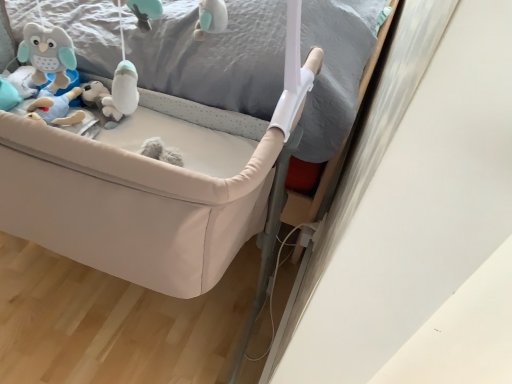
This screenshot has height=384, width=512. Identify the location of beige fabric bed frame at center. point(214,55).

What do you see at coordinates (214, 55) in the screenshot? I see `beige fabric bed frame at center` at bounding box center [214, 55].

What is the approximate width of beige fabric infant bed at center?

36.99 inches.

This screenshot has width=512, height=384. What do you see at coordinates (146, 189) in the screenshot?
I see `beige fabric infant bed at center` at bounding box center [146, 189].

Measure the distance between point (141, 175) and camera.

The depth of point (141, 175) is 25.63 inches.

What are the coordinates of `beige fabric infant bed at center` in the screenshot? It's located at (146, 189).

Find the location of `beige fabric bed frame at center`. beige fabric bed frame at center is located at coordinates [214, 55].

Which is more to the left, beige fabric bed frame at center or beige fabric infant bed at center?

Positioned to the left is beige fabric infant bed at center.

Is beige fabric bed frame at center behind beige fabric infant bed at center?

That is False.

Does point (147, 79) lie in front of point (29, 180)?

No, it is behind (29, 180).

From the image's perspective, would you say beige fabric bed frame at center is positioned over beige fabric infant bed at center?

Yes.

From a real-world perspective, which object stands above the other?

beige fabric bed frame at center, from a real-world perspective.

Considering the relative sizes of beige fabric bed frame at center and beige fabric infant bed at center in the image provided, is beige fabric bed frame at center wider than beige fabric infant bed at center?

In fact, beige fabric bed frame at center might be narrower than beige fabric infant bed at center.

Considering the relative sizes of beige fabric bed frame at center and beige fabric infant bed at center in the image provided, is beige fabric bed frame at center taller than beige fabric infant bed at center?

Incorrect, the height of beige fabric bed frame at center is not larger of that of beige fabric infant bed at center.

Considering the relative sizes of beige fabric bed frame at center and beige fabric infant bed at center in the image provided, is beige fabric bed frame at center smaller than beige fabric infant bed at center?

Correct, beige fabric bed frame at center occupies less space than beige fabric infant bed at center.

Which is correct: beige fabric bed frame at center is inside beige fabric infant bed at center, or outside of it?

beige fabric bed frame at center is not inside beige fabric infant bed at center, it's outside.

Is beige fabric bed frame at center positioned far away from beige fabric infant bed at center?

beige fabric bed frame at center is near beige fabric infant bed at center, not far away.

Is beige fabric bed frame at center oriented away from beige fabric infant bed at center?

That's not correct — beige fabric bed frame at center is not looking away from beige fabric infant bed at center.

How different are the orientations of beige fabric bed frame at center and beige fabric infant bed at center in degrees?

A: beige fabric bed frame at center and beige fabric infant bed at center are facing 2.07 degrees away from each other.

The width and height of the screenshot is (512, 384). Identify the location of infant bed below the beige fabric bed frame at center (from the image's perspective). (146, 189).

Which is more to the left, beige fabric infant bed at center or beige fabric bed frame at center?

beige fabric infant bed at center.

Which object is closer to the camera taking this photo, beige fabric infant bed at center or beige fabric bed frame at center?

Positioned in front is beige fabric bed frame at center.

Is point (300, 110) closer to viewer compared to point (146, 74)?

That is True.

From the image's perspective, which one is positioned higher, beige fabric infant bed at center or beige fabric bed frame at center?

beige fabric bed frame at center is shown above in the image.

Looking at this image, from a real-world perspective, is beige fabric infant bed at center above or below beige fabric bed frame at center?

Clearly, from a real-world perspective, beige fabric infant bed at center is below beige fabric bed frame at center.

Is beige fabric infant bed at center thinner than beige fabric bed frame at center?

No, beige fabric infant bed at center is not thinner than beige fabric bed frame at center.

Does beige fabric infant bed at center have a lesser height compared to beige fabric bed frame at center?

No.

Who is smaller, beige fabric infant bed at center or beige fabric bed frame at center?

beige fabric bed frame at center.

Is beige fabric infant bed at center surrounding beige fabric bed frame at center?

Definitely not — beige fabric bed frame at center is not inside beige fabric infant bed at center.

Is beige fabric infant bed at center positioned far away from beige fabric bed frame at center?

beige fabric infant bed at center is near beige fabric bed frame at center, not far away.

Could you tell me if beige fabric infant bed at center is facing beige fabric bed frame at center?

No, beige fabric infant bed at center is not facing towards beige fabric bed frame at center.

What's the angular difference between beige fabric infant bed at center and beige fabric bed frame at center's facing directions?

The angular difference between beige fabric infant bed at center and beige fabric bed frame at center is 2.07 degrees.

Image resolution: width=512 pixels, height=384 pixels. What are the coordinates of `infant bed located below the beige fabric bed frame at center (from the image's perspective)` in the screenshot? It's located at (146, 189).

Locate an element on the screen. The image size is (512, 384). infant bed lying on the left of beige fabric bed frame at center is located at coordinates (146, 189).

Locate an element on the screen. Image resolution: width=512 pixels, height=384 pixels. infant bed below the beige fabric bed frame at center (from the image's perspective) is located at coordinates (146, 189).